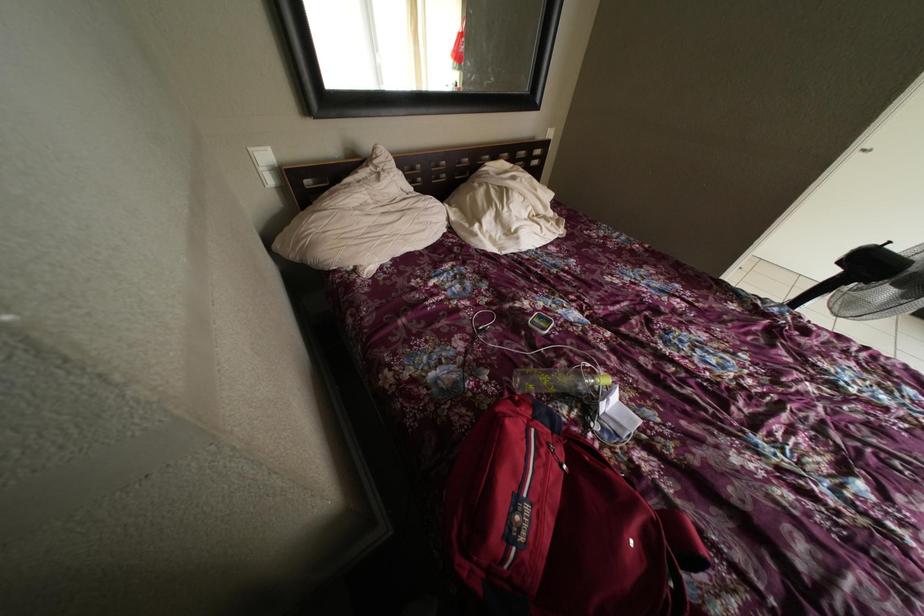
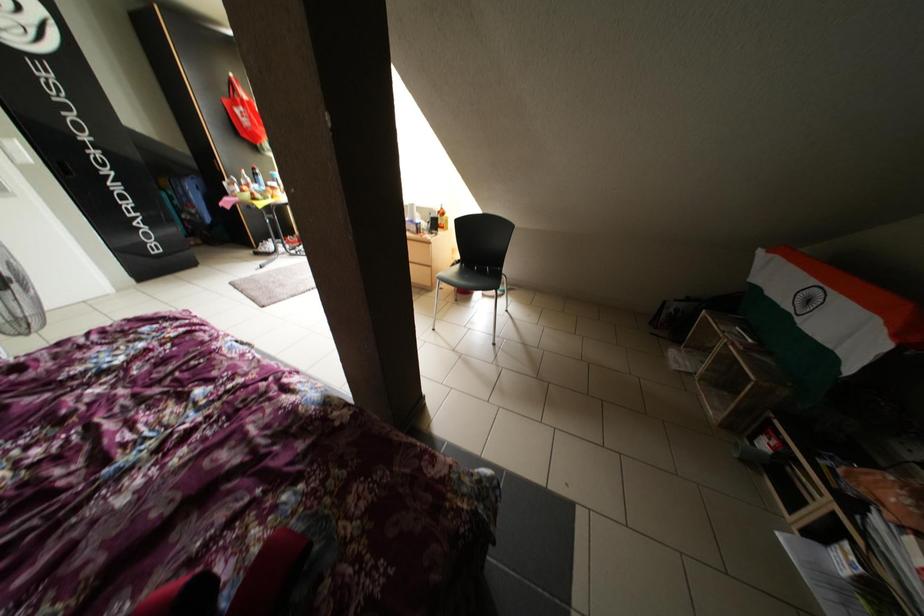
First-person continuous shooting, in which direction is the camera rotating?

The rotation direction of the camera is right-down.